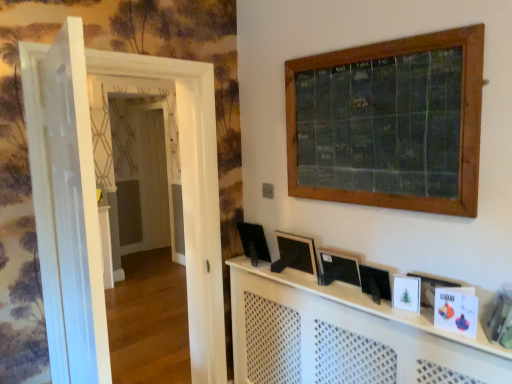
The height and width of the screenshot is (384, 512). What are the coordinates of `free point in front of white matte picture frame at lower right, the 3th picture frame viewed from the back` in the screenshot? It's located at (417, 316).